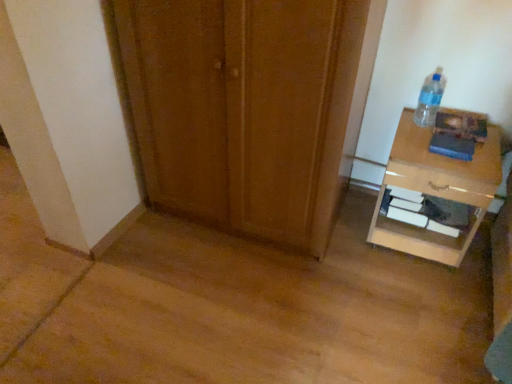
I want to click on space that is in front of light brown glossy nightstand at right, so click(x=426, y=298).